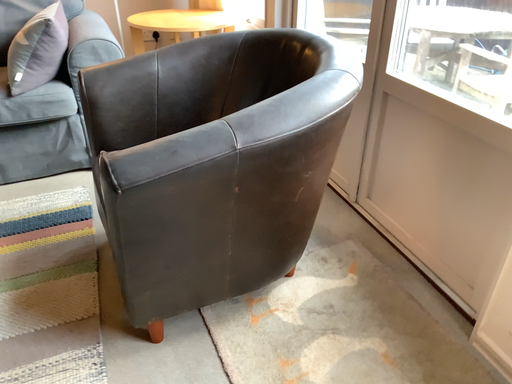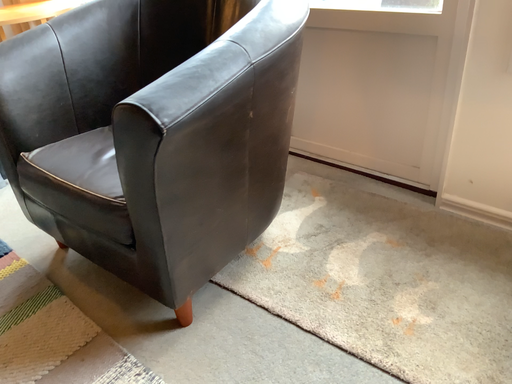
Question: Which way did the camera rotate in the video?

Choices:
 (A) rotated left
 (B) rotated right

Answer: (B)